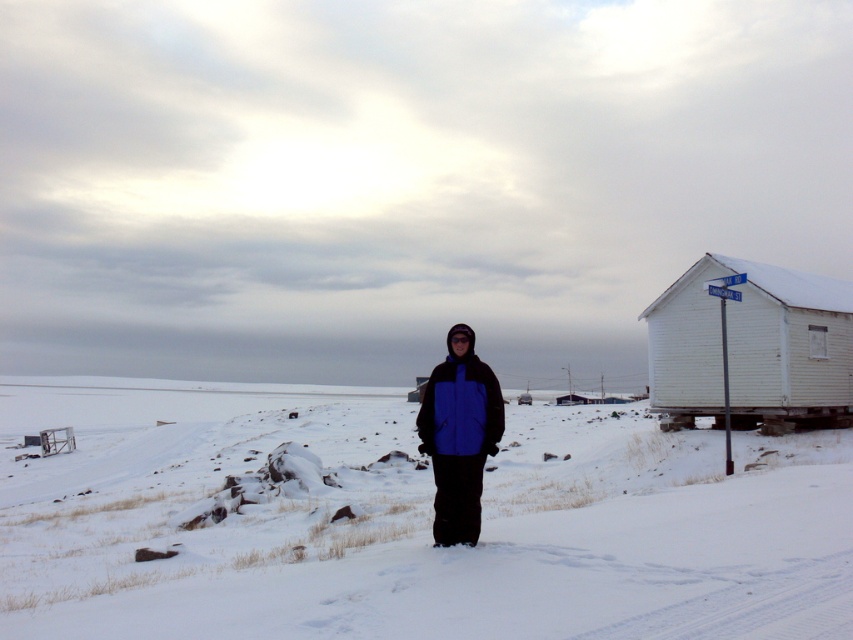
You are standing at the point where the person is in the winter scene. Looking around, you see a white fluffy snow at center located at point (x=405, y=520). Can you walk directly to that point without encountering any obstacles?

Yes, you can walk directly to the point (x=405, y=520) where the white fluffy snow at center is located because there are no objects mentioned between you and that point in the scene description.

You are a hiker who wants to take a photo of the white fluffy snow at center and the blue matte jacket at center. Which object should you focus on first if you want both to be in focus?

The white fluffy snow at center is taller than the blue matte jacket at center, so you should focus on the white fluffy snow at center first to ensure both are in focus.

You are a drone operator trying to land a drone on a specific point. The drone is currently above the person in the snow. The landing point is at point (x=405, y=520). According to the image, where is this point located?

The point (x=405, y=520) is on white fluffy snow at center, so the drone should land on the white fluffy snow at center.